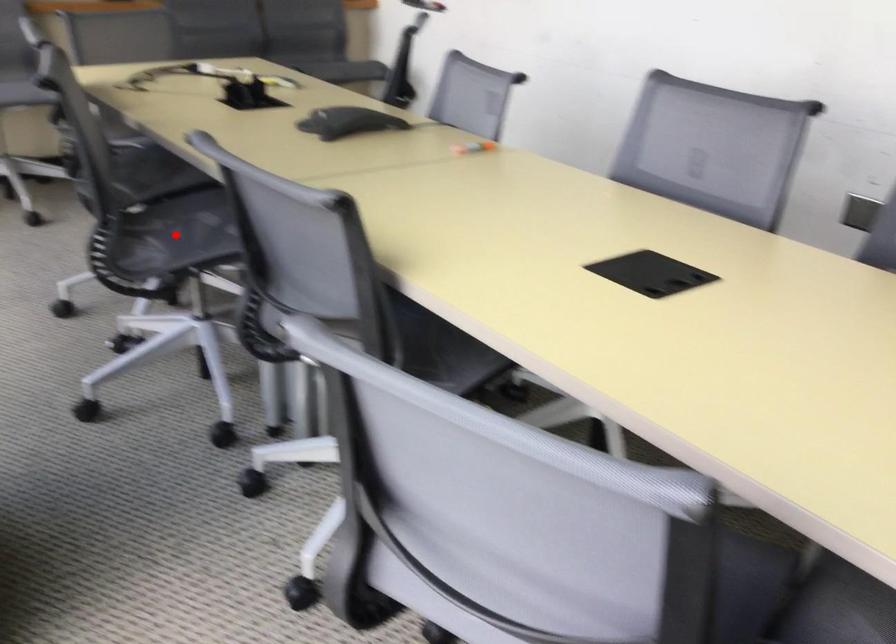
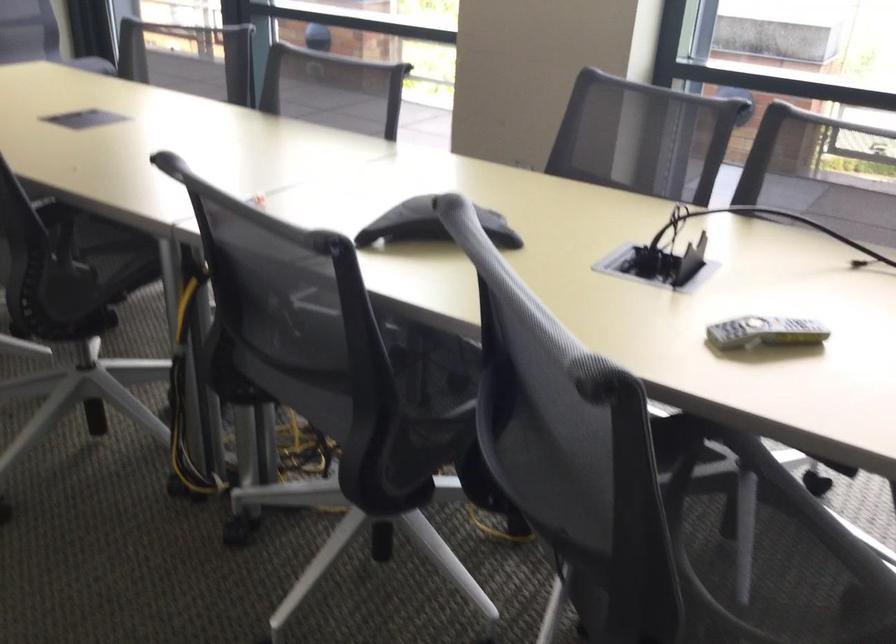
Question: I am providing you with two images of the same scene from different viewpoints. A red point is marked on the first image. At the location where the point appears in image 1, is it still visible in image 2?

Choices:
 (A) Yes
 (B) No

Answer: (B)